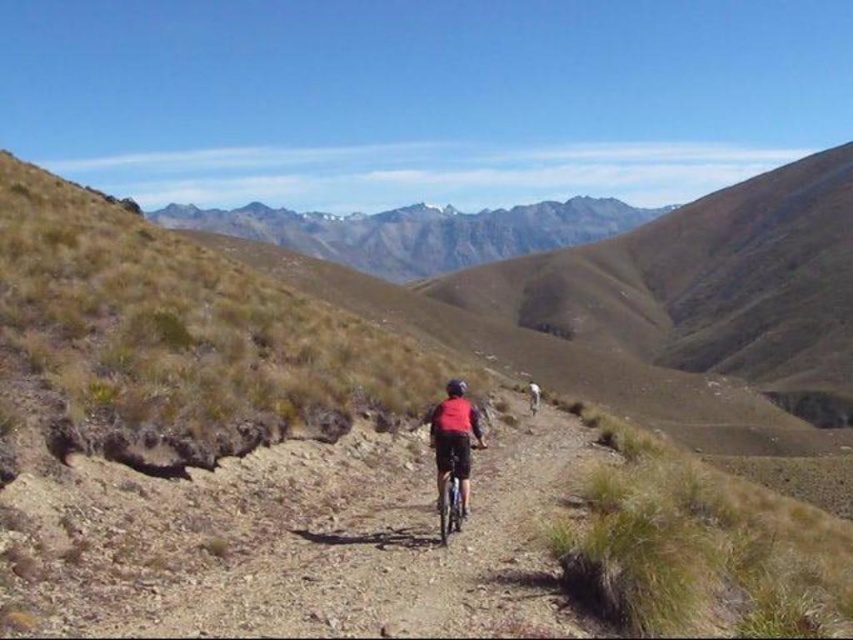
Between point (273, 241) and point (445, 474), which one is positioned in front?

Point (445, 474) is in front.

Who is higher up, rugged granite mountains at center or red matte jacket at center?

Positioned higher is rugged granite mountains at center.

Is point (476, 248) closer to camera compared to point (462, 387)?

That is False.

This screenshot has height=640, width=853. Identify the location of rugged granite mountains at center. (418, 230).